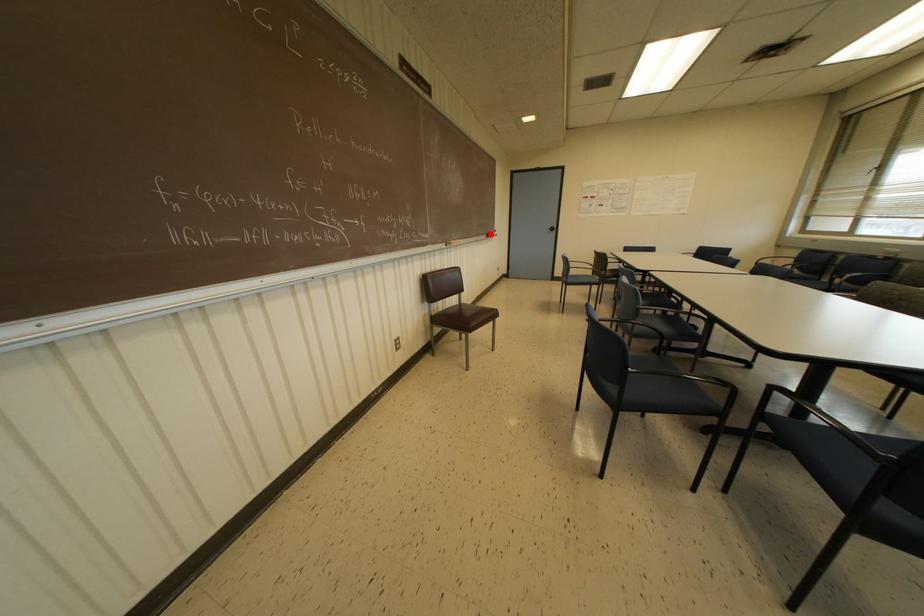
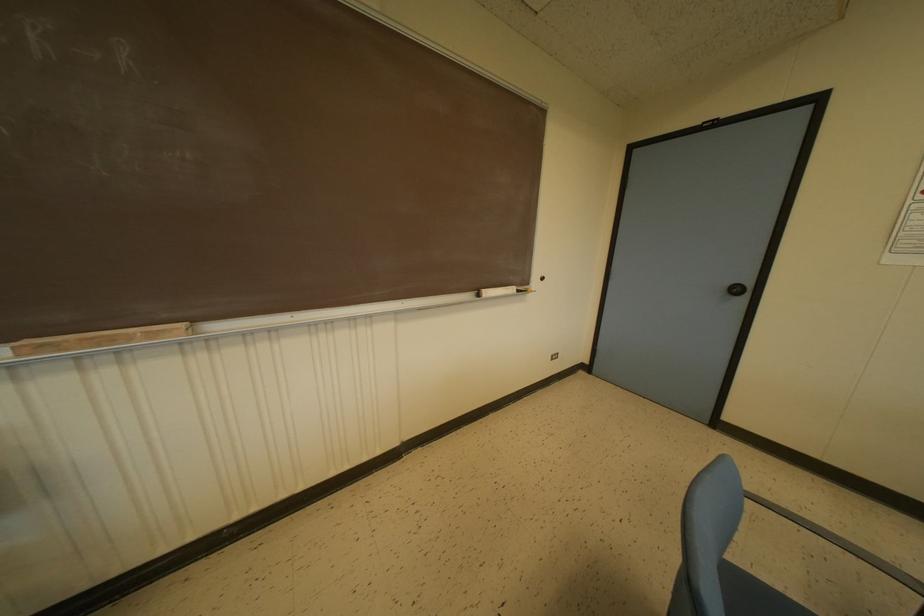
The point at the highlighted location is marked in the first image. Where is the corresponding point in the second image?

(487, 292)